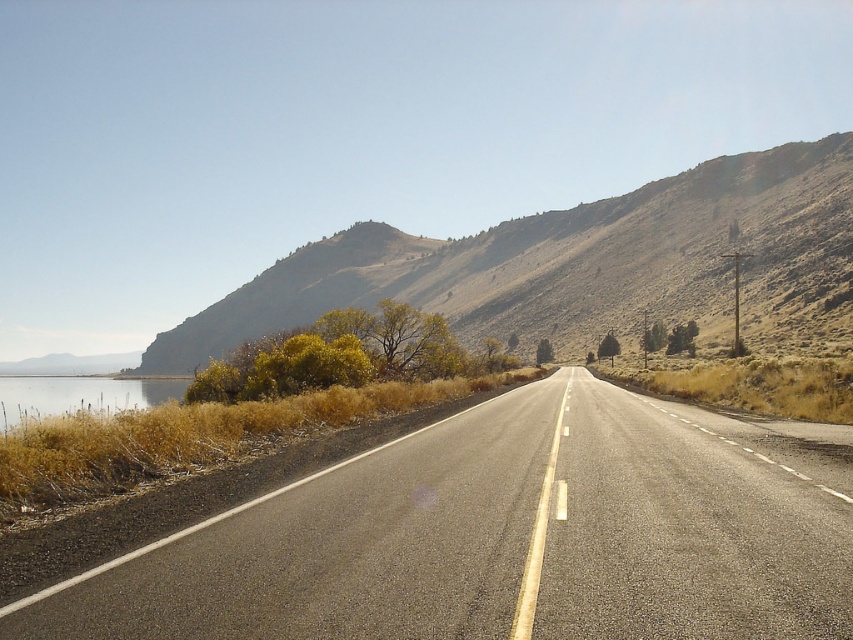
You are driving a car and want to park on the side of the asphalt road at center. However, there is a dull brown hillside at upper center nearby. Based on their positions, which object is closer to your current position?

The asphalt road at center is closer to your current position because it is to the right of the dull brown hillside at upper center, which is further away.

You are driving a car and see the dull brown hillside at upper center and the clear water at left in your view. Which object is closer to your car?

The dull brown hillside at upper center is closer to your car because it is further to the viewer than the clear water at left, meaning it appears nearer in the visual perspective.

Looking at this image, you are a hiker standing at the base of the dull brown hillside at upper center and want to reach the clear water at left. Which direction should you head to get there?

The dull brown hillside at upper center is to the right of clear water at left, so you should head to the left to reach the clear water at left.